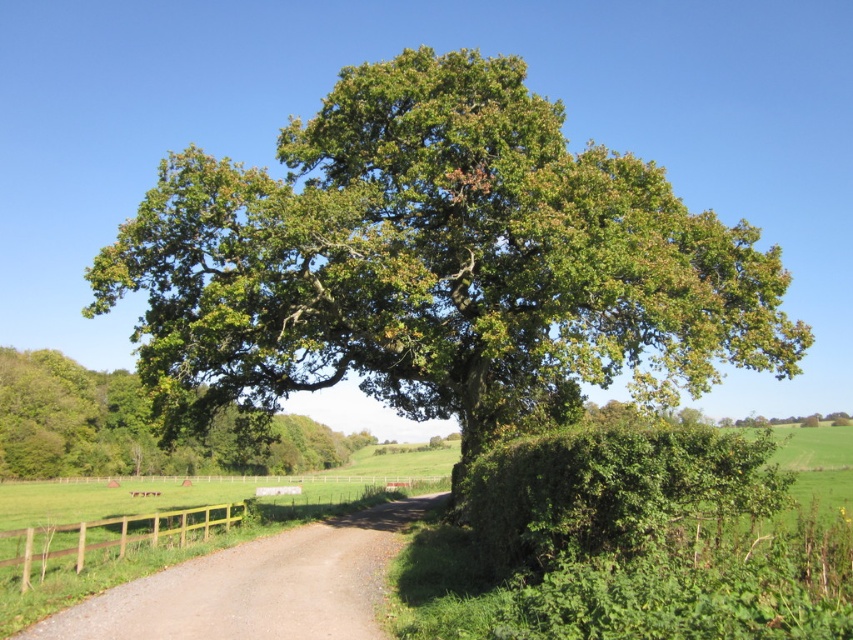
Looking at this image, who is more distant from viewer, (x=688, y=384) or (x=474, y=532)?

Positioned behind is point (x=688, y=384).

Does green leafy oak at center have a greater width compared to green leafy hedge at lower right?

Correct, the width of green leafy oak at center exceeds that of green leafy hedge at lower right.

Does point (213, 243) come closer to viewer compared to point (718, 445)?

No, (213, 243) is behind (718, 445).

The image size is (853, 640). What are the coordinates of `green leafy oak at center` in the screenshot? It's located at (438, 262).

Can you confirm if green leafy tree at center is positioned to the right of brown wooden fence at lower left?

Incorrect, green leafy tree at center is not on the right side of brown wooden fence at lower left.

Which is in front, point (346, 440) or point (111, 518)?

Point (111, 518) is more forward.

The height and width of the screenshot is (640, 853). I want to click on green leafy tree at center, so click(137, 428).

At what (x,y) coordinates should I click in order to perform the action: click on green leafy hedge at lower right. Please return your answer as a coordinate pair (x, y). Looking at the image, I should click on (612, 490).

Is green leafy hedge at lower right smaller than brown wooden fence at lower left?

Yes, green leafy hedge at lower right is smaller than brown wooden fence at lower left.

The width and height of the screenshot is (853, 640). Describe the element at coordinates (612, 490) in the screenshot. I see `green leafy hedge at lower right` at that location.

The height and width of the screenshot is (640, 853). I want to click on green leafy hedge at lower right, so click(x=612, y=490).